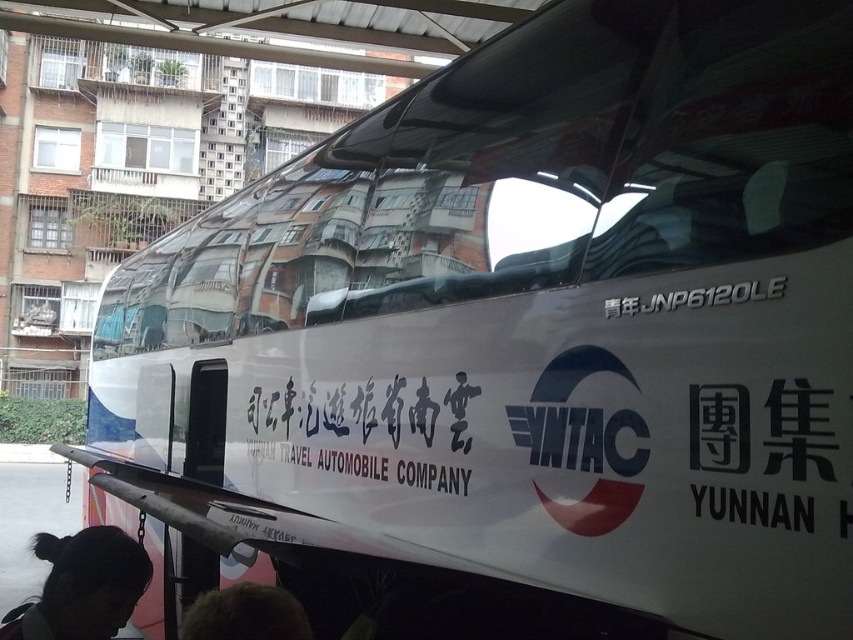
In the scene shown: You are a passenger waiting at the bus station and see the bus with the dark brown hair at lower center and the white metallic text at center. Which object is positioned lower in the image?

The dark brown hair at lower center is positioned below the white metallic text at center, so it is lower in the image.